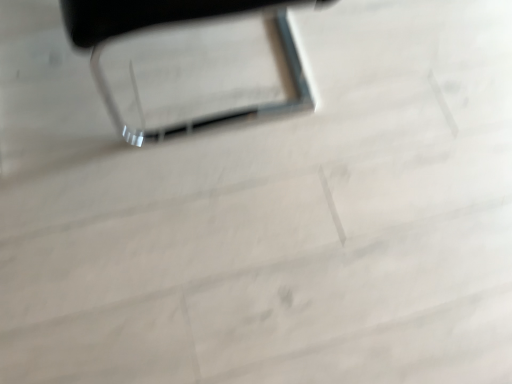
Locate an element on the screen. The height and width of the screenshot is (384, 512). unoccupied area in front of clear acrylic stand at upper center is located at coordinates [x=175, y=221].